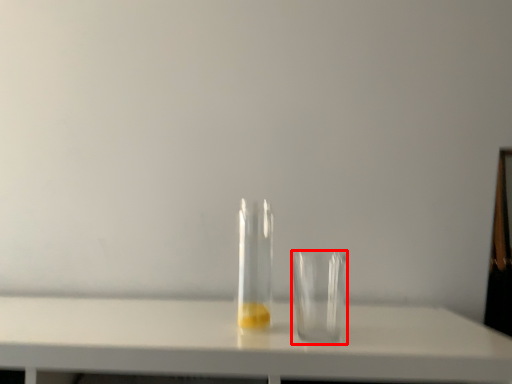
Question: From the image's perspective, what is the correct spatial positioning of tableware (annotated by the red box) in reference to bottle?

Choices:
 (A) below
 (B) above

Answer: (A)